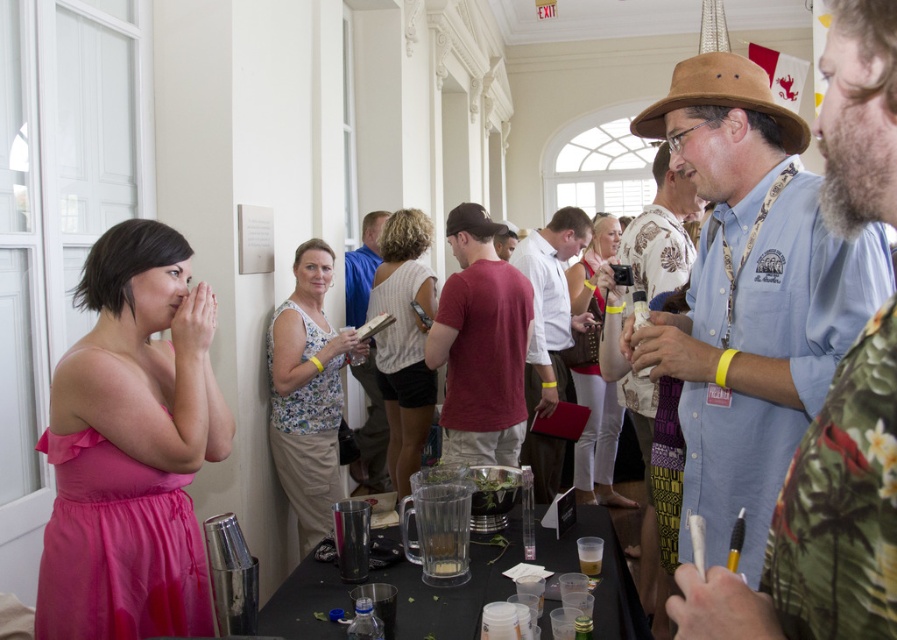
Question: Which point is closer to the camera?

Choices:
 (A) transparent plastic table at lower center
 (B) white textured blouse at center

Answer: (A)

Question: Is printed fabric shirt at center below white textured dress at center?

Choices:
 (A) yes
 (B) no

Answer: (B)

Question: Can you confirm if matte red t-shirt at center is thinner than translucent plastic cup at lower center?

Choices:
 (A) yes
 (B) no

Answer: (B)

Question: Which of the following is the closest to the observer?

Choices:
 (A) (590, 570)
 (B) (441, 560)

Answer: (B)

Question: Is floral print tank top at center to the right of translucent plastic cup at lower center from the viewer's perspective?

Choices:
 (A) no
 (B) yes

Answer: (A)

Question: Which object is the closest to the printed fabric shirt at center?

Choices:
 (A) white textured dress at center
 (B) white shirt at center

Answer: (B)